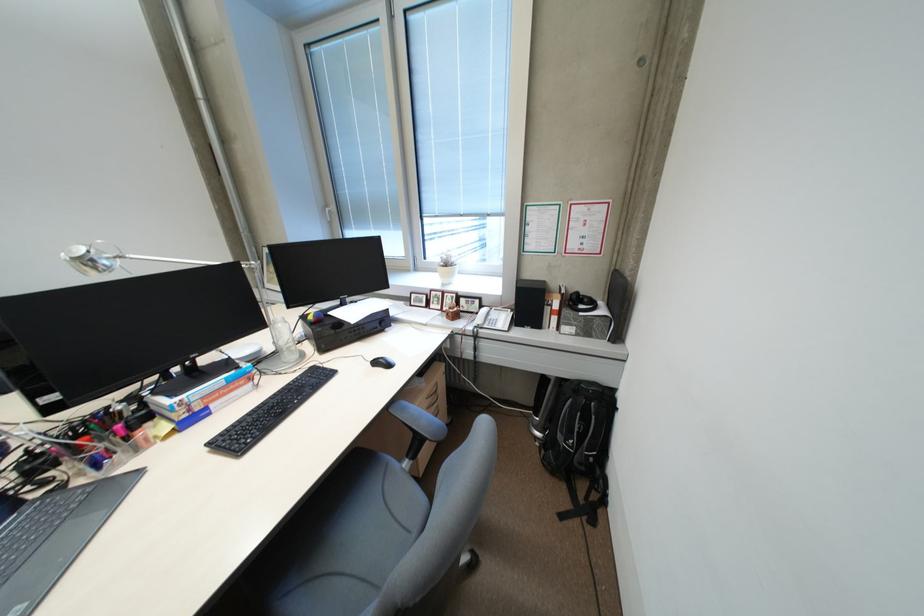
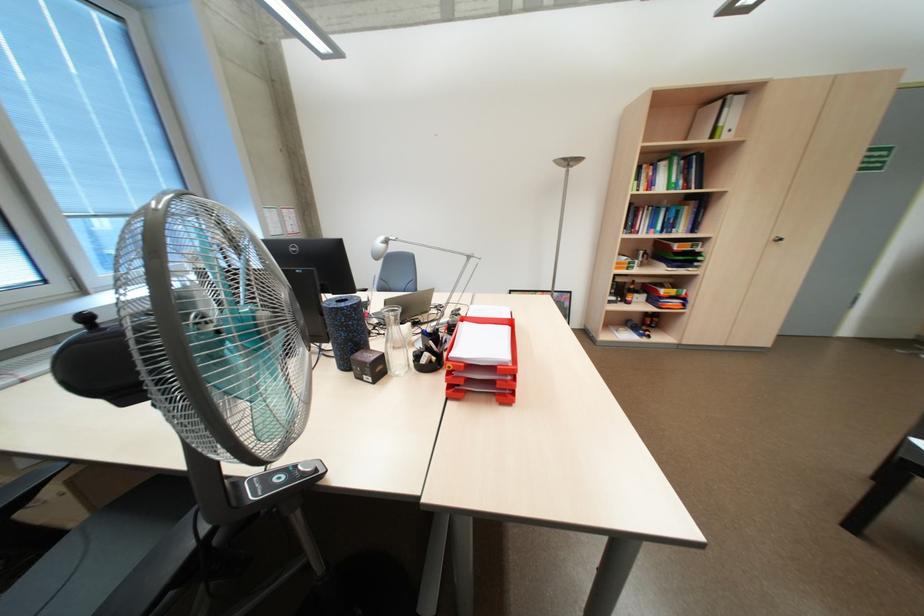
Question: I am providing you with two images of the same scene from different viewpoints. Please identify which objects are invisible in image2.

Choices:
 (A) bottle on shelf
 (B) black computer mouse
 (C) cabinet door handle
 (D) brown spine book

Answer: (B)